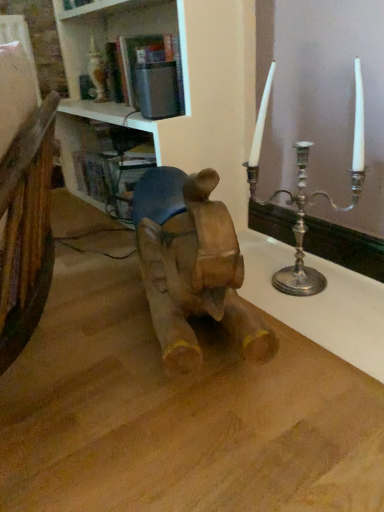
Question: Can you confirm if white glossy bookshelf at upper center is thinner than wooden horse at center?

Choices:
 (A) yes
 (B) no

Answer: (B)

Question: Considering the relative positions of white glossy bookshelf at upper center and wooden horse at center in the image provided, is white glossy bookshelf at upper center behind wooden horse at center?

Choices:
 (A) yes
 (B) no

Answer: (A)

Question: Is white glossy bookshelf at upper center placed right next to wooden horse at center?

Choices:
 (A) yes
 (B) no

Answer: (B)

Question: Considering the relative sizes of white glossy bookshelf at upper center and wooden horse at center in the image provided, is white glossy bookshelf at upper center bigger than wooden horse at center?

Choices:
 (A) no
 (B) yes

Answer: (B)

Question: Is white glossy bookshelf at upper center oriented away from wooden horse at center?

Choices:
 (A) yes
 (B) no

Answer: (B)

Question: From a real-world perspective, is white glossy bookshelf at upper center beneath wooden horse at center?

Choices:
 (A) yes
 (B) no

Answer: (B)

Question: Is wooden horse at center positioned beyond the bounds of white glossy bookshelf at upper center?

Choices:
 (A) no
 (B) yes

Answer: (B)

Question: From the image's perspective, is wooden horse at center on top of white glossy bookshelf at upper center?

Choices:
 (A) no
 (B) yes

Answer: (A)

Question: From a real-world perspective, is wooden horse at center on white glossy bookshelf at upper center?

Choices:
 (A) yes
 (B) no

Answer: (B)

Question: Can you confirm if wooden horse at center is taller than white glossy bookshelf at upper center?

Choices:
 (A) no
 (B) yes

Answer: (A)

Question: Are wooden horse at center and white glossy bookshelf at upper center making contact?

Choices:
 (A) yes
 (B) no

Answer: (B)

Question: Is wooden horse at center wider than white glossy bookshelf at upper center?

Choices:
 (A) no
 (B) yes

Answer: (A)

Question: Is silver metallic candlestick at upper right next to white glossy bookshelf at upper center?

Choices:
 (A) no
 (B) yes

Answer: (A)